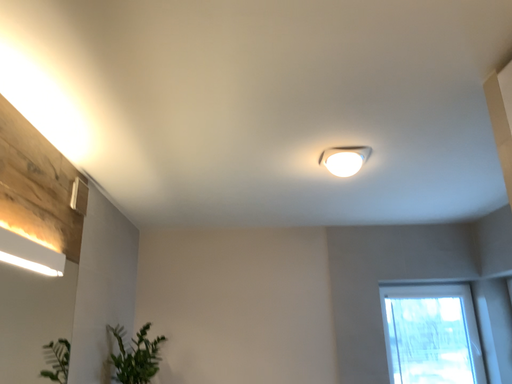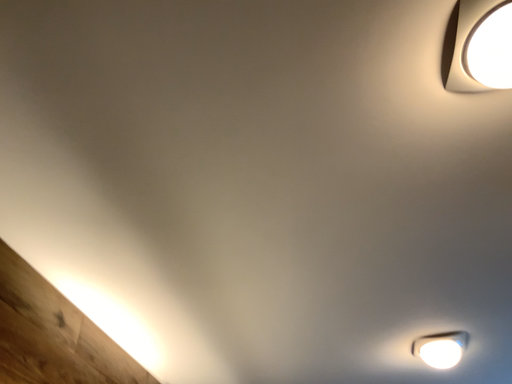
Question: How did the camera likely rotate when shooting the video?

Choices:
 (A) rotated upward
 (B) rotated downward

Answer: (A)